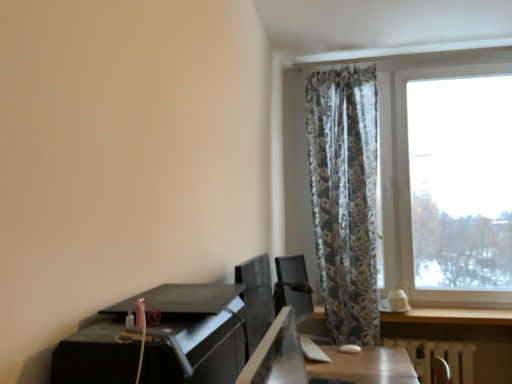
Question: From a real-world perspective, is transparent glass window at right above or below white textured radiator at lower right?

Choices:
 (A) below
 (B) above

Answer: (B)

Question: Based on their positions, is transparent glass window at right located to the left or right of white textured radiator at lower right?

Choices:
 (A) right
 (B) left

Answer: (B)

Question: Which object is the closest to the transparent glass window at right?

Choices:
 (A) satin black monitor at center
 (B) black glossy desk at lower left
 (C) white textured radiator at lower right

Answer: (C)

Question: Based on their relative distances, which object is farther from the white textured radiator at lower right?

Choices:
 (A) transparent glass window at right
 (B) satin black monitor at center
 (C) black glossy desk at lower left

Answer: (C)